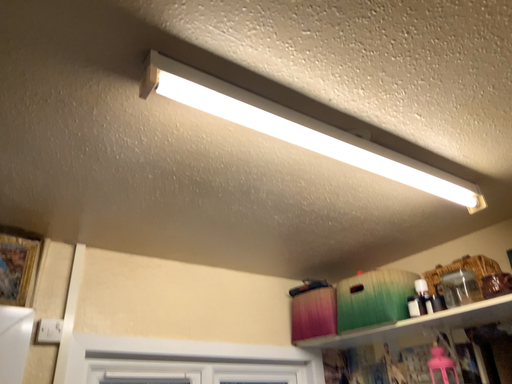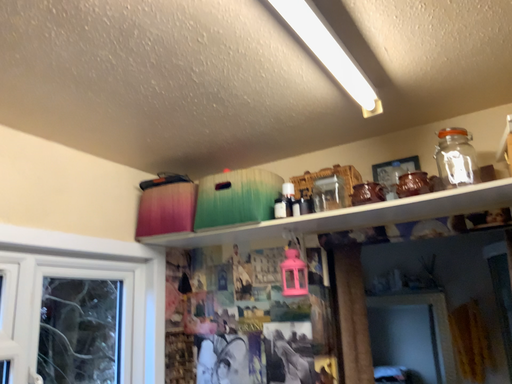
Question: How did the camera likely rotate when shooting the video?

Choices:
 (A) rotated right
 (B) rotated left

Answer: (A)